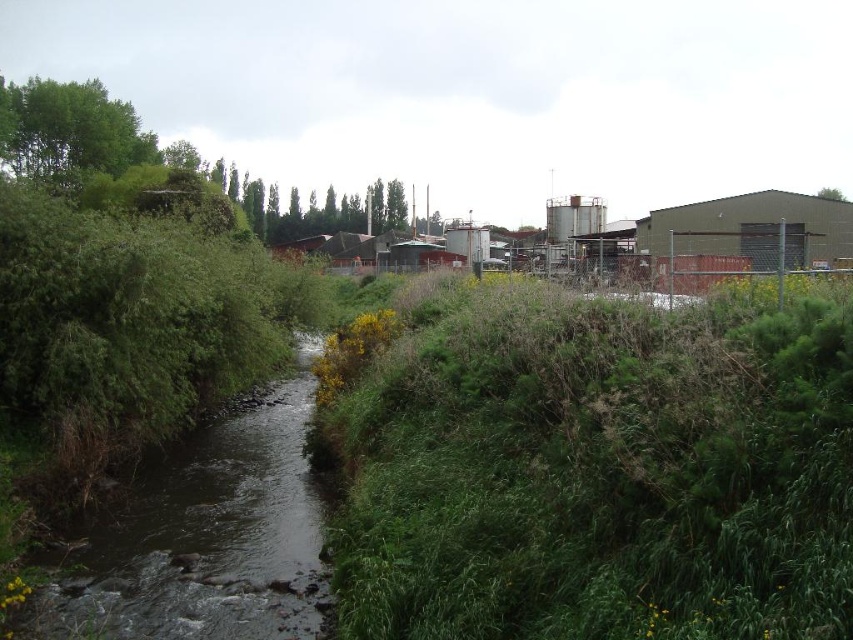
Can you confirm if green grassy patch at center is taller than dark brown water at center?

Yes, green grassy patch at center is taller than dark brown water at center.

Who is lower down, green grassy patch at center or dark brown water at center?

Positioned lower is dark brown water at center.

Is point (463, 330) farther from camera compared to point (251, 518)?

No, it is not.

Image resolution: width=853 pixels, height=640 pixels. What are the coordinates of `green grassy patch at center` in the screenshot? It's located at (596, 467).